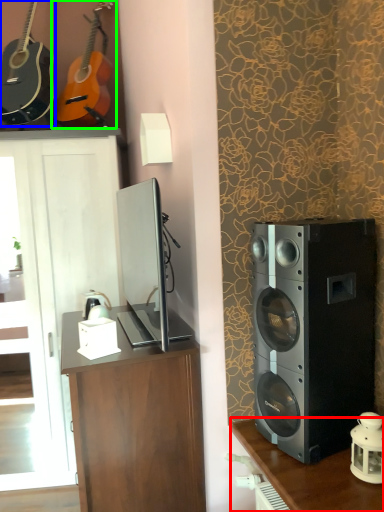
Question: Which object is the farthest from table (highlighted by a red box)? Choose among these: guitar (highlighted by a blue box) or guitar (highlighted by a green box).

Choices:
 (A) guitar
 (B) guitar

Answer: (A)